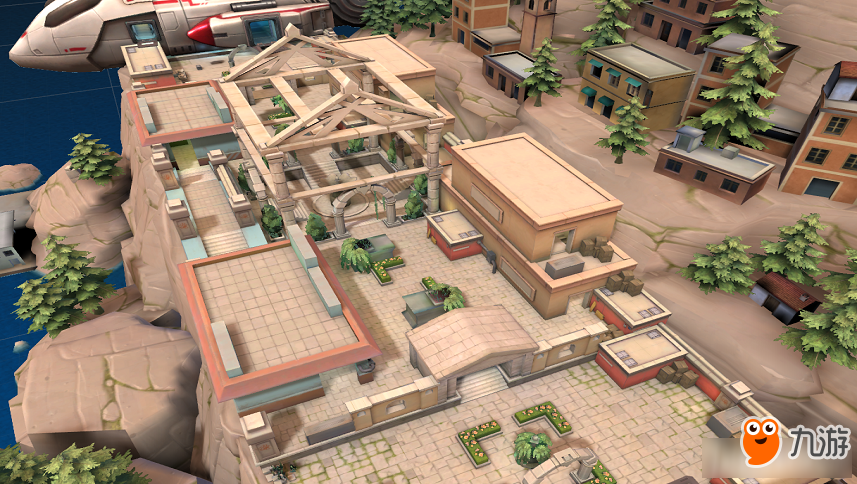
At what (x,y) coordinates should I click in order to perform the action: click on window. Please return your answer as a coordinate pair (x, y). This screenshot has width=857, height=484. Looking at the image, I should click on (727, 187), (830, 125).